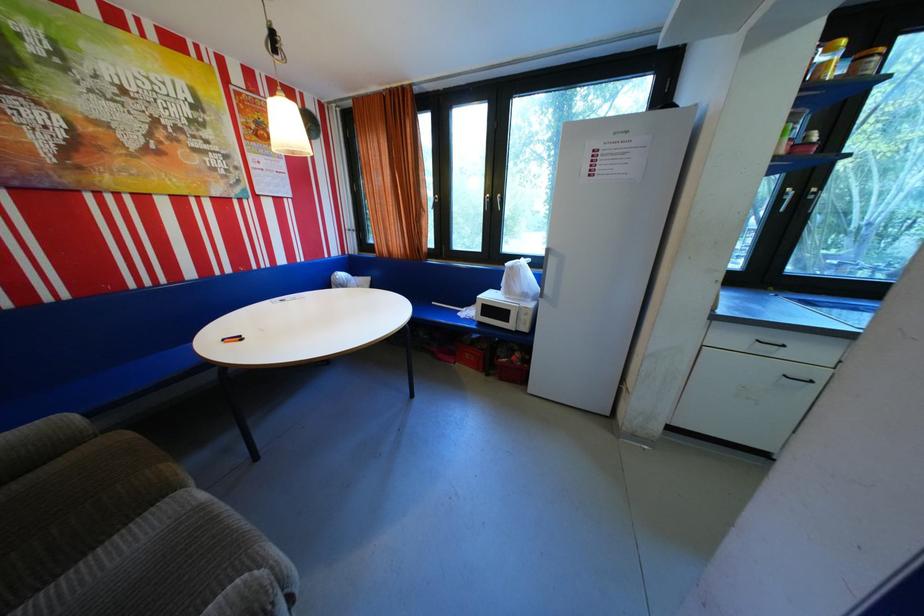
What are the coordinates of `amber glass jar` in the screenshot? It's located at (827, 60).